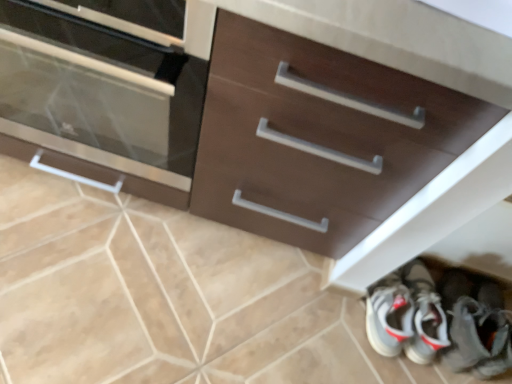
Question: From a real-world perspective, relative to beige ceramic tile at lower center, is matte brown cabinet at left vertically above or below?

Choices:
 (A) above
 (B) below

Answer: (A)

Question: Considering their positions, is matte brown cabinet at left located in front of or behind beige ceramic tile at lower center?

Choices:
 (A) front
 (B) behind

Answer: (A)

Question: Estimate the real-world distances between objects in this image. Which object is farther from the beige ceramic tile at lower center?

Choices:
 (A) matte brown cabinet at left
 (B) white leather sneakers at lower right

Answer: (B)

Question: Which is nearer to the matte brown cabinet at left?

Choices:
 (A) beige ceramic tile at lower center
 (B) white leather sneakers at lower right

Answer: (A)